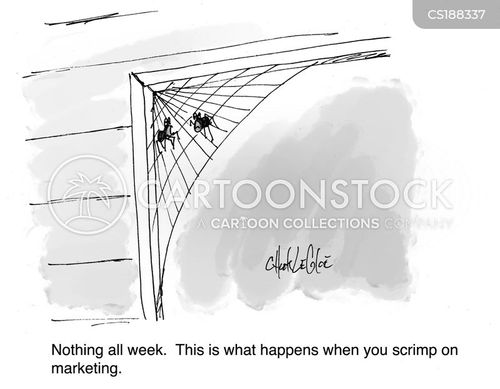
Find the location of a particular element. doorway is located at coordinates (153, 82).